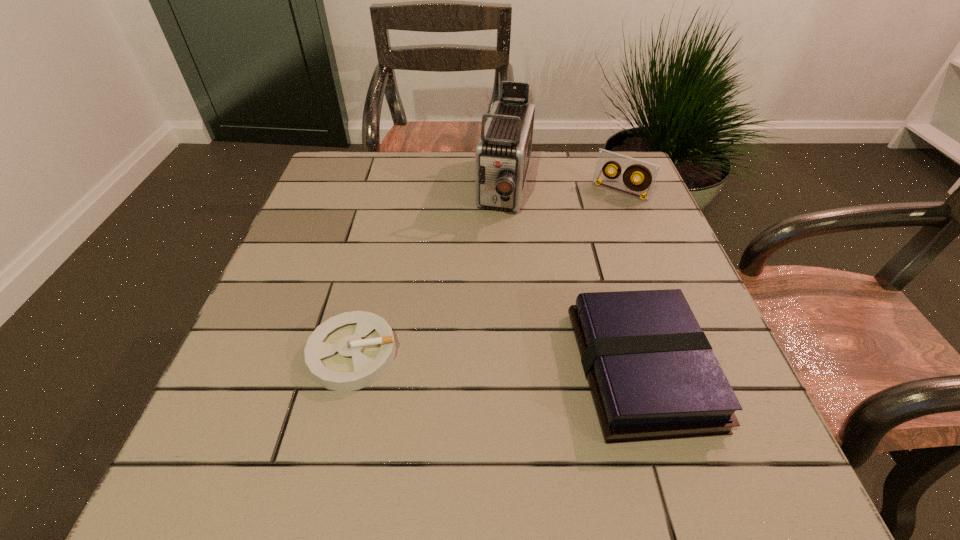
Locate an element on the screen. Image resolution: width=960 pixels, height=540 pixels. videotape situated at the right edge is located at coordinates (647, 172).

You are a GUI agent. You are given a task and a screenshot of the screen. Output one action in this format:
    pyautogui.click(x=<x>, y=<y>)
    Task: Click on the object that is at the near left corner
    Image resolution: width=960 pixels, height=540 pixels.
    Given the screenshot: What is the action you would take?
    pyautogui.click(x=349, y=351)

This screenshot has width=960, height=540. Find the location of `object that is at the far right corner`. object that is at the far right corner is located at coordinates (647, 172).

You are a GUI agent. You are given a task and a screenshot of the screen. Output one action in this format:
    pyautogui.click(x=<x>, y=<y>)
    Task: Click on the object at the near right corner
    
    Given the screenshot: What is the action you would take?
    pyautogui.click(x=652, y=373)

This screenshot has height=540, width=960. I want to click on blank area at the far edge, so click(395, 176).

Find the location of `vacant area at the left edge of the desktop`. vacant area at the left edge of the desktop is located at coordinates (361, 227).

Identify the location of vacant region at the right edge of the desktop. This screenshot has width=960, height=540. (623, 216).

What are the coordinates of `free space at the far left corner` in the screenshot? It's located at (380, 171).

I want to click on vacant space at the far right corner, so click(606, 196).

At what (x,y) coordinates should I click in order to perform the action: click on unoccupied position between the ashtray and the second tallest object. Please return your answer as a coordinate pair (x, y). This screenshot has height=540, width=960. Looking at the image, I should click on (487, 273).